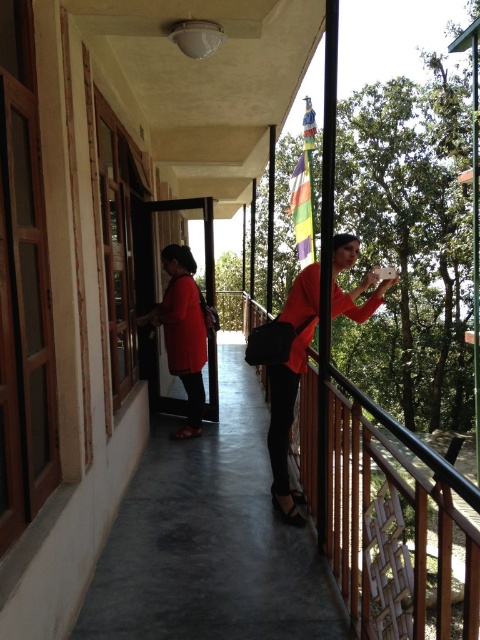
Consider the image. Is matte red shirt at left to the right of rainbow fabric flag at upper center from the viewer's perspective?

Incorrect, matte red shirt at left is not on the right side of rainbow fabric flag at upper center.

Where is `matte red shirt at left`? matte red shirt at left is located at coordinates (182, 332).

Between point (361, 291) and point (309, 125), which one is positioned behind?

Point (309, 125)

Describe the element at coordinates (290, 387) in the screenshot. The image size is (480, 640). I see `matte red blouse at center` at that location.

Where is `matte red blouse at center`? The image size is (480, 640). matte red blouse at center is located at coordinates (290, 387).

Is point (296, 490) positioned in front of point (179, 291)?

That is True.

Is matte red blouse at center positioned in front of matte red shirt at left?

Yes.

Who is more forward, (x=275, y=460) or (x=182, y=312)?

Point (x=275, y=460) is in front.

Where is `matte red blouse at center`? The width and height of the screenshot is (480, 640). matte red blouse at center is located at coordinates (290, 387).